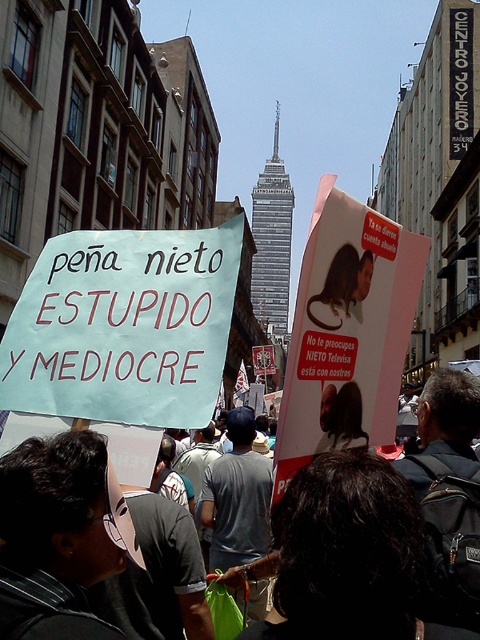
Based on the photo, you are a photographer capturing the protest scene. You notice the white paper sign at center and the dark gray fabric at center. Which object is located to the left when viewed from your perspective?

The white paper sign at center is positioned on the left side of the dark gray fabric at center, so it is located to the left when viewed from your perspective.

You are a journalist trying to capture the protest scene. You notice the white paper sign at center and the dark gray fabric at center. Which object is shorter in height?

→ The white paper sign at center is shorter in height compared to the dark gray fabric at center because it is not as tall as the dark gray fabric at center.